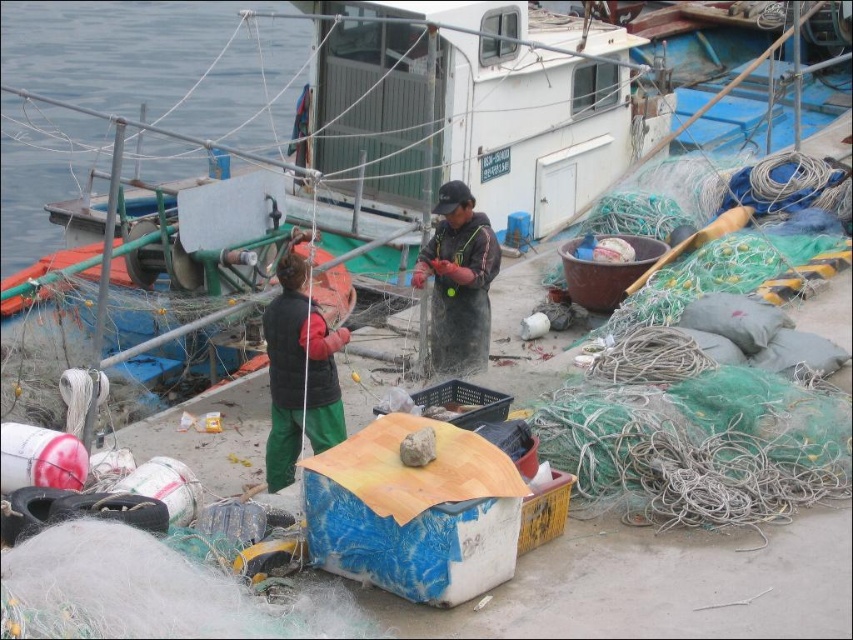
Question: Does dark green fabric jacket at center appear under dark gray fabric jacket at center?

Choices:
 (A) no
 (B) yes

Answer: (B)

Question: Which object is farther from the camera taking this photo?

Choices:
 (A) dark gray fabric jacket at center
 (B) dark green fabric jacket at center

Answer: (A)

Question: Does dark green fabric jacket at center appear under dark gray fabric jacket at center?

Choices:
 (A) no
 (B) yes

Answer: (B)

Question: Observing the image, what is the correct spatial positioning of dark green fabric jacket at center in reference to dark gray fabric jacket at center?

Choices:
 (A) above
 (B) below

Answer: (B)